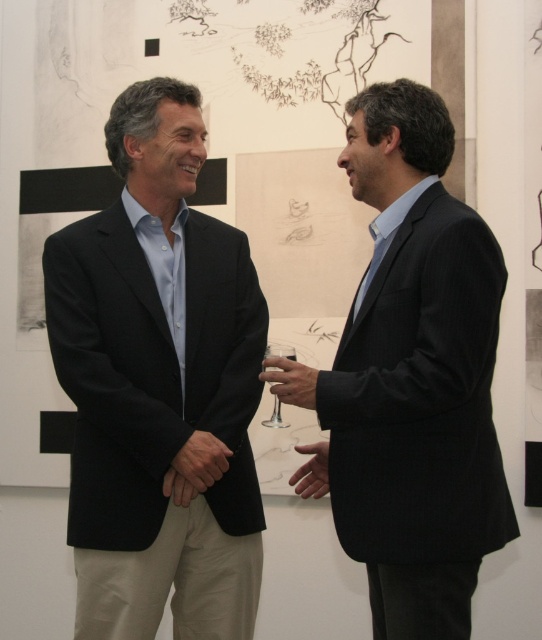
Question: Does smooth skin hand at center have a smaller size compared to clear glass wine glass at center?

Choices:
 (A) no
 (B) yes

Answer: (B)

Question: Which point is farther to the camera?

Choices:
 (A) (325, 474)
 (B) (281, 387)

Answer: (A)

Question: Where is matte black suit at center located in relation to clear glass wine glass at center in the image?

Choices:
 (A) below
 (B) above

Answer: (B)

Question: Which point is closer to the camera?

Choices:
 (A) dark pinstripe suit at right
 (B) matte black suit at center
 (C) clear glass wine glass at center
 (D) smooth beige hand at center

Answer: (A)

Question: Which of the following is the closest to the observer?

Choices:
 (A) clear glass wine glass at center
 (B) smooth beige hand at center
 (C) matte glass wine glass at center
 (D) smooth skin hand at center

Answer: (C)

Question: Observing the image, what is the correct spatial positioning of matte black suit at center in reference to dark pinstripe suit at right?

Choices:
 (A) below
 (B) above

Answer: (A)